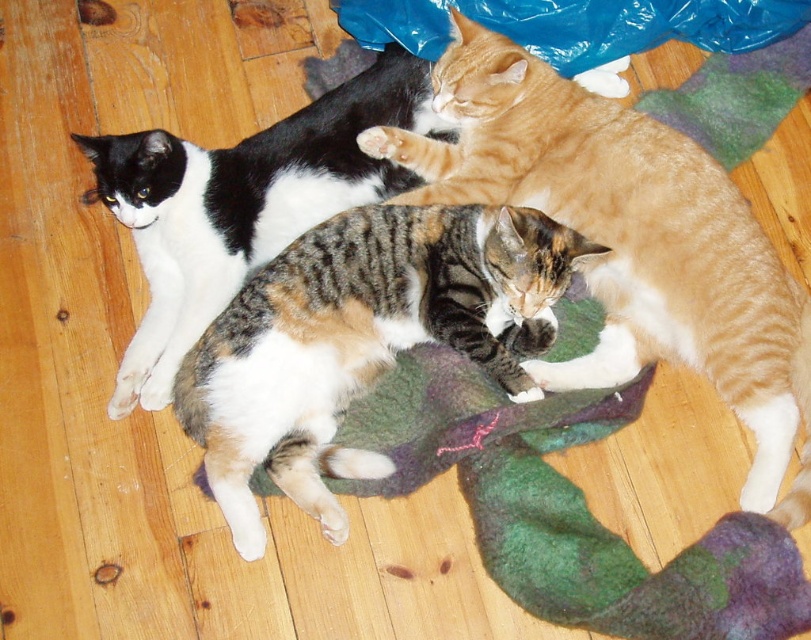
Is calico fur cat at center shorter than black and white fur cat at upper left?

Correct, calico fur cat at center is not as tall as black and white fur cat at upper left.

Is point (224, 460) positioned behind point (149, 236)?

No, (224, 460) is in front of (149, 236).

This screenshot has height=640, width=811. What do you see at coordinates (363, 340) in the screenshot?
I see `calico fur cat at center` at bounding box center [363, 340].

The image size is (811, 640). Identify the location of calico fur cat at center. (363, 340).

Which of these two, tabby fur cat at center or black and white fur cat at upper left, stands shorter?

black and white fur cat at upper left is shorter.

The image size is (811, 640). What do you see at coordinates (629, 240) in the screenshot? I see `tabby fur cat at center` at bounding box center [629, 240].

Who is more distant from viewer, (745, 310) or (110, 193)?

Point (110, 193)

This screenshot has height=640, width=811. In order to click on tabby fur cat at center in this screenshot , I will do `click(629, 240)`.

Can you confirm if tabby fur cat at center is taller than multicolored felt sock at lower right?

Yes, tabby fur cat at center is taller than multicolored felt sock at lower right.

Locate an element on the screen. Image resolution: width=811 pixels, height=640 pixels. tabby fur cat at center is located at coordinates (629, 240).